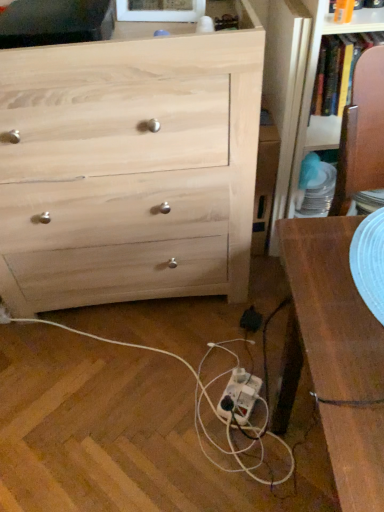
In order to face natural wood chest of drawers at upper left, should I rotate leftwards or rightwards?

Rotate your view left by about 10.830°.

Describe the element at coordinates (130, 169) in the screenshot. I see `natural wood chest of drawers at upper left` at that location.

Describe the element at coordinates (240, 395) in the screenshot. I see `white plastic extension cord at lower center` at that location.

Describe the element at coordinates (206, 400) in the screenshot. I see `white plastic power strip at lower center` at that location.

Find the location of a particular element. The width and height of the screenshot is (384, 512). natural wood chest of drawers at upper left is located at coordinates (130, 169).

Would you say natural wood chest of drawers at upper left is part of white plastic extension cord at lower center's contents?

No, white plastic extension cord at lower center does not contain natural wood chest of drawers at upper left.

This screenshot has width=384, height=512. Find the location of `extension cord on the right of the natural wood chest of drawers at upper left`. extension cord on the right of the natural wood chest of drawers at upper left is located at coordinates (240, 395).

Considering the relative sizes of white plastic extension cord at lower center and natural wood chest of drawers at upper left in the image provided, is white plastic extension cord at lower center bigger than natural wood chest of drawers at upper left?

No.

Considering the positions of objects white plastic extension cord at lower center and natural wood chest of drawers at upper left in the image provided, who is more to the left, white plastic extension cord at lower center or natural wood chest of drawers at upper left?

natural wood chest of drawers at upper left is more to the left.

How much distance is there between white plastic extension cord at lower center and white plastic power strip at lower center?

4.26 inches.

Is white plastic extension cord at lower center far from white plastic power strip at lower center?

No.

Does point (243, 400) appear closer or farther from the camera than point (256, 399)?

Point (243, 400) appears to be closer to the viewer than point (256, 399).

From a real-world perspective, is white plastic extension cord at lower center located beneath white plastic power strip at lower center?

No, from a real-world perspective, white plastic extension cord at lower center is not under white plastic power strip at lower center.

Is natural wood chest of drawers at upper left closer to camera compared to white plastic power strip at lower center?

Yes, natural wood chest of drawers at upper left is closer to the viewer.

Are natural wood chest of drawers at upper left and white plastic power strip at lower center far apart?

No, natural wood chest of drawers at upper left is not far from white plastic power strip at lower center.

Is natural wood chest of drawers at upper left not inside white plastic power strip at lower center?

Absolutely, natural wood chest of drawers at upper left is external to white plastic power strip at lower center.

From a real-world perspective, is natural wood chest of drawers at upper left located beneath white plastic power strip at lower center?

No.

Based on their sizes in the image, would you say natural wood chest of drawers at upper left is bigger or smaller than white plastic extension cord at lower center?

Clearly, natural wood chest of drawers at upper left is larger in size than white plastic extension cord at lower center.

Are natural wood chest of drawers at upper left and white plastic extension cord at lower center located far from each other?

natural wood chest of drawers at upper left is actually quite close to white plastic extension cord at lower center.

Which is behind, natural wood chest of drawers at upper left or white plastic extension cord at lower center?

white plastic extension cord at lower center is more distant.

Could you tell me if natural wood chest of drawers at upper left is facing white plastic extension cord at lower center?

Yes, natural wood chest of drawers at upper left is oriented towards white plastic extension cord at lower center.

Between white plastic power strip at lower center and white plastic extension cord at lower center, which one has less height?

white plastic power strip at lower center.

This screenshot has height=512, width=384. I want to click on extension cord lying below the white plastic power strip at lower center (from the image's perspective), so click(240, 395).

Considering the sizes of white plastic power strip at lower center and white plastic extension cord at lower center in the image, is white plastic power strip at lower center wider or thinner than white plastic extension cord at lower center?

Clearly, white plastic power strip at lower center has more width compared to white plastic extension cord at lower center.

From the image's perspective, is white plastic power strip at lower center on white plastic extension cord at lower center?

Correct, white plastic power strip at lower center appears higher than white plastic extension cord at lower center in the image.

Considering the sizes of objects white plastic power strip at lower center and natural wood chest of drawers at upper left in the image provided, who is shorter, white plastic power strip at lower center or natural wood chest of drawers at upper left?

Standing shorter between the two is white plastic power strip at lower center.

From the picture: Does white plastic power strip at lower center appear on the right side of natural wood chest of drawers at upper left?

Yes.

How different are the orientations of white plastic power strip at lower center and natural wood chest of drawers at upper left in degrees?

The angle between the facing direction of white plastic power strip at lower center and the facing direction of natural wood chest of drawers at upper left is 94.1 degrees.

In the image, there is a white plastic extension cord at lower center. At what (x,y) coordinates should I click in order to perform the action: click on the chest of drawers above it (from the image's perspective). Please return your answer as a coordinate pair (x, y). The height and width of the screenshot is (512, 384). Looking at the image, I should click on (130, 169).

Identify the location of extension cord above the white plastic power strip at lower center (from a real-world perspective). (240, 395).

Which object lies further to the anchor point natural wood chest of drawers at upper left, white plastic extension cord at lower center or white plastic power strip at lower center?

The object further to natural wood chest of drawers at upper left is white plastic extension cord at lower center.

Considering their positions, is white plastic extension cord at lower center positioned further to white plastic power strip at lower center than natural wood chest of drawers at upper left?

Based on the image, natural wood chest of drawers at upper left appears to be further to white plastic power strip at lower center.

When comparing their distances from white plastic extension cord at lower center, does natural wood chest of drawers at upper left or white plastic power strip at lower center seem further?

natural wood chest of drawers at upper left is positioned further to the anchor white plastic extension cord at lower center.

Based on their spatial positions, is white plastic power strip at lower center or white plastic extension cord at lower center further from natural wood chest of drawers at upper left?

white plastic extension cord at lower center lies further to natural wood chest of drawers at upper left than the other object.

From the image, which object appears to be nearer to white plastic power strip at lower center, natural wood chest of drawers at upper left or white plastic extension cord at lower center?

Based on the image, white plastic extension cord at lower center appears to be nearer to white plastic power strip at lower center.

Considering their positions, is white plastic power strip at lower center positioned further to white plastic extension cord at lower center than natural wood chest of drawers at upper left?

Based on the image, natural wood chest of drawers at upper left appears to be further to white plastic extension cord at lower center.

Locate an element on the screen. Image resolution: width=384 pixels, height=512 pixels. string between natural wood chest of drawers at upper left and white plastic extension cord at lower center vertically is located at coordinates point(206,400).